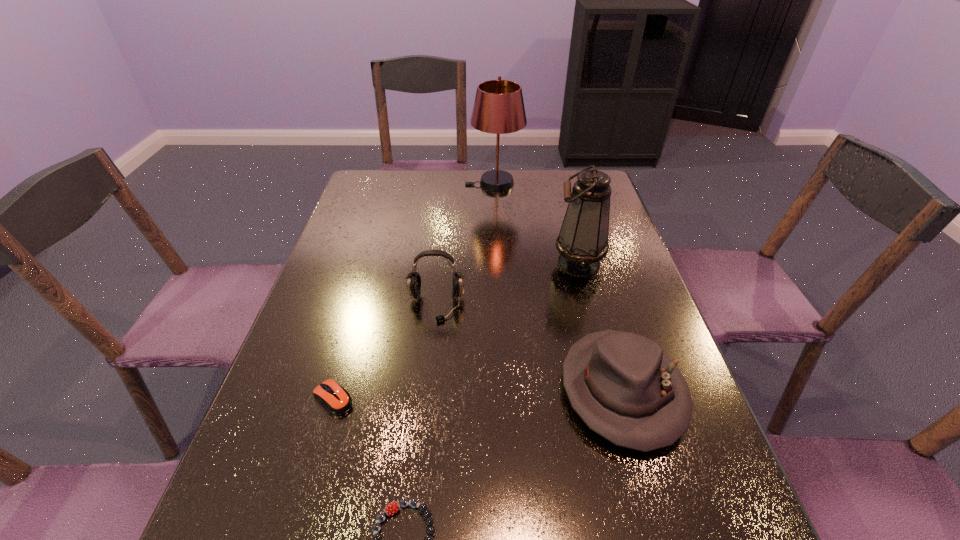
This screenshot has height=540, width=960. Identify the location of the tallest object. (498, 108).

Identify the location of the farthest object. (498, 108).

Identify the location of the fifth nearest object. (583, 239).

Find the location of `the fifth shortest object`. the fifth shortest object is located at coordinates (583, 239).

This screenshot has width=960, height=540. I want to click on headset, so click(413, 279).

The image size is (960, 540). Identify the location of the third farthest object. (413, 279).

This screenshot has height=540, width=960. Identify the location of the third shortest object. (624, 387).

You are a GUI agent. You are given a task and a screenshot of the screen. Output one action in this format:
    pyautogui.click(x=<x>, y=<y>)
    Task: Click on the leftmost object
    This screenshot has height=540, width=960.
    Given the screenshot: What is the action you would take?
    pyautogui.click(x=335, y=398)

Where is `the second shortest object`? Image resolution: width=960 pixels, height=540 pixels. the second shortest object is located at coordinates (335, 398).

Locate an element on the screen. The height and width of the screenshot is (540, 960). vacant area situated 0.310m on the front-facing side of the lampshade is located at coordinates (378, 184).